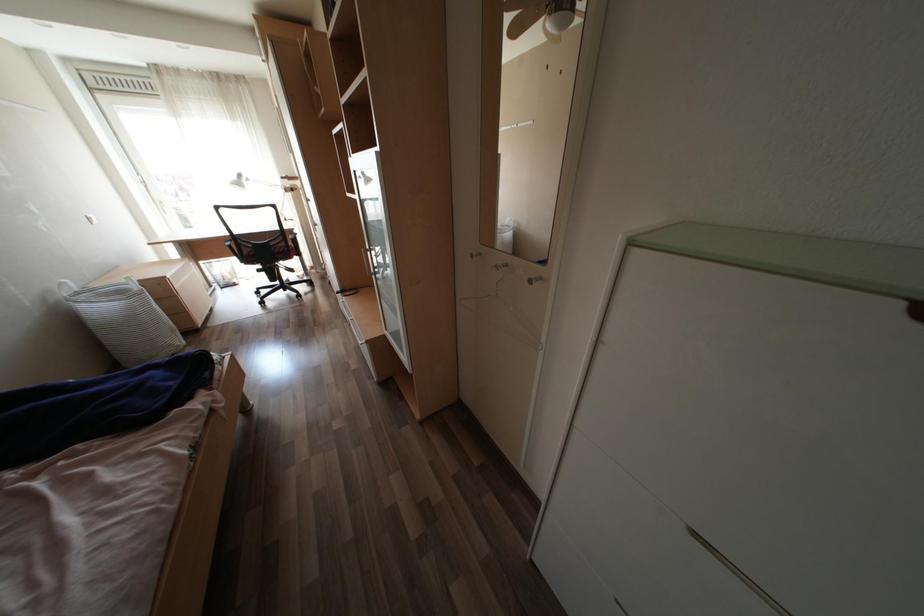
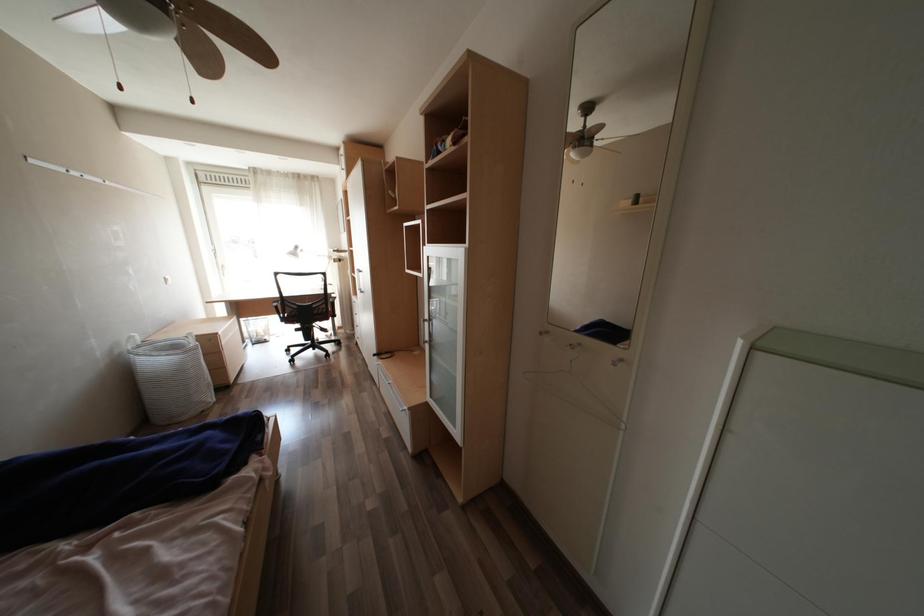
In the scene shown: Which direction would the cameraman need to move to produce the second image?

The movement direction of the cameraman is left, backward.